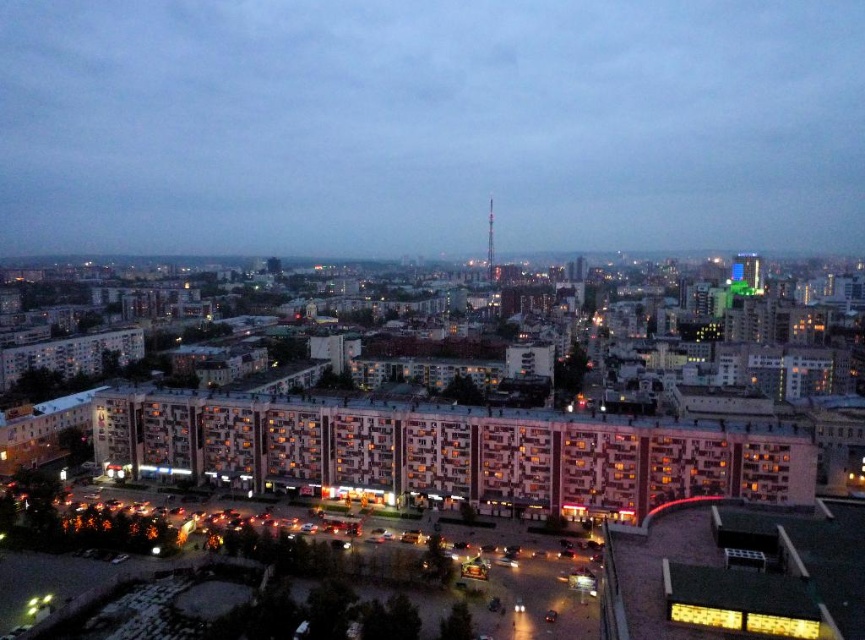
You are standing at the center of the city square. You want to take a photo of the smooth concrete tower at center. Which direction should you face to capture it in your camera view?

You should face the direction where the smooth concrete tower at center is located, which is at point coordinates of (428, 124). Since the tower is at the center, facing towards the center of the city square will allow you to capture it in your camera view.

You are standing in the city at twilight and want to take a photo of the smooth concrete tower at center and the metallic silver tv tower at center. Which tower should you focus on first if you want to capture both in one frame without moving the camera?

You should focus on the smooth concrete tower at center first because it is closer to you than the metallic silver tv tower at center, so it will appear larger and more prominent in the frame. By focusing on it first, you can ensure both towers are in the same frame without needing to adjust the camera position.

You are a city planner evaluating the skyline. You need to determine which of the two towers, the smooth concrete tower at center or the metallic silver tv tower at center, would be more visible from a distance. Based on their sizes, which one would likely dominate the skyline more?

The smooth concrete tower at center is larger in size than the metallic silver tv tower at center, so it would likely dominate the skyline more and be more visible from a distance.